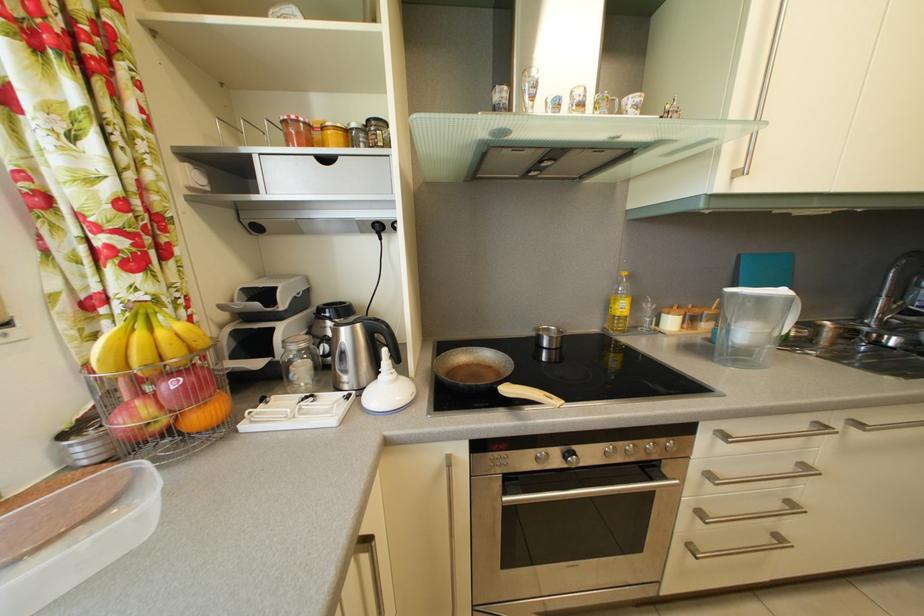
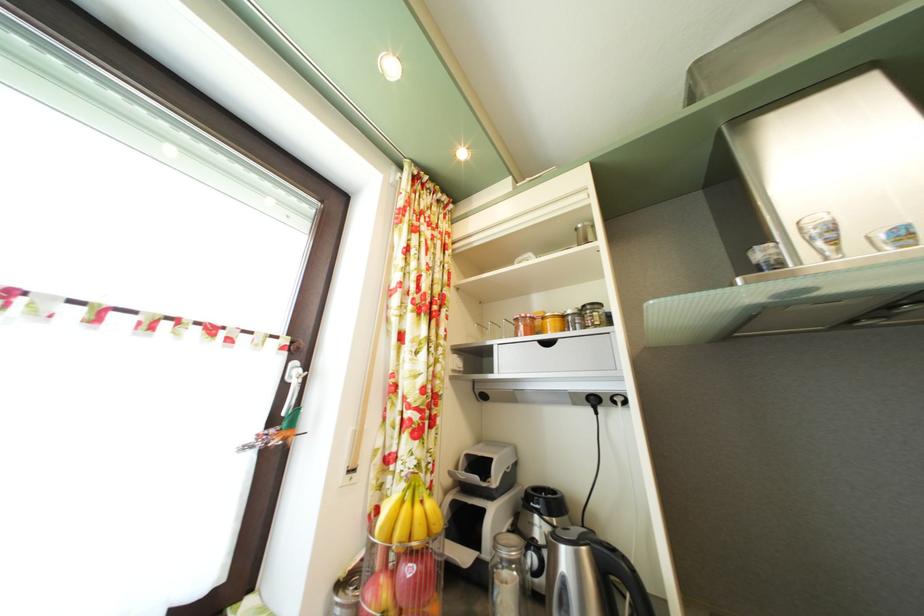
Where in the second image is the point corresponding to (367,333) from the first image?

(592, 556)